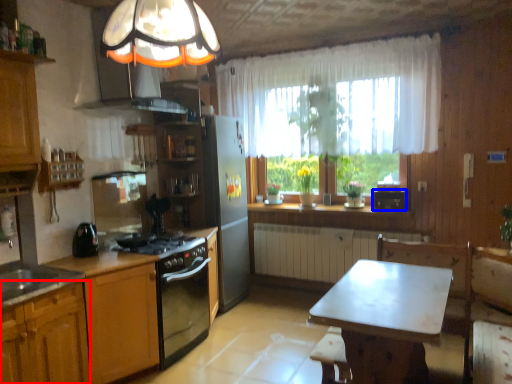
Question: Which object appears closest to the camera in this image, cabinetry (highlighted by a red box) or appliance (highlighted by a blue box)?

Choices:
 (A) cabinetry
 (B) appliance

Answer: (A)